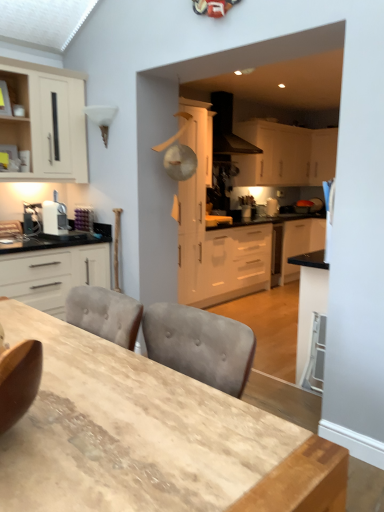
Question: Considering their positions, is white matte cabinet at upper center, placed as the 2th cabinetry when sorted from back to front, located in front of or behind wooden table at center?

Choices:
 (A) behind
 (B) front

Answer: (A)

Question: Is white matte cabinet at upper center, placed as the 2th cabinetry when sorted from back to front, wider or thinner than wooden table at center?

Choices:
 (A) wide
 (B) thin

Answer: (B)

Question: Estimate the real-world distances between objects in this image. Which object is closer to the white matte cabinet at center, acting as the third cabinetry starting from the back?

Choices:
 (A) white glossy countertop at center
 (B) white matte cabinet at upper center, placed as the 2th cabinetry when sorted from back to front
 (C) wooden table at center
 (D) white glossy cabinet at upper right, placed as the first cabinetry when sorted from right to left
 (E) black matte range hood at upper center

Answer: (A)

Question: Which object is positioned farthest from the white glossy countertop at center?

Choices:
 (A) white matte cabinet at center, the third cabinetry viewed from the front
 (B) black matte range hood at upper center
 (C) white matte cabinet at left, arranged as the first cabinetry when viewed from the front
 (D) white matte cabinet at upper center, marked as the 2th cabinetry in a right-to-left arrangement
 (E) matte white cabinet at upper left, which is counted as the fifth cabinetry, starting from the right

Answer: (E)